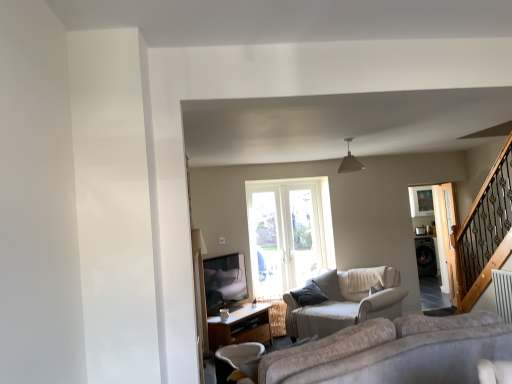
Question: From the image's perspective, relative to clear glass screen door at right, the second screen door positioned from the back, is beige fabric studio couch at center above or below?

Choices:
 (A) below
 (B) above

Answer: (A)

Question: From their relative heights in the image, would you say beige fabric studio couch at center is taller or shorter than clear glass screen door at right, the second screen door positioned from the back?

Choices:
 (A) short
 (B) tall

Answer: (A)

Question: Which object is positioned farthest from the wooden table at lower center?

Choices:
 (A) beige fabric studio couch at center
 (B) clear glass screen door at right, the second screen door positioned from the back
 (C) clear glass screen door at right, the 1th screen door when ordered from back to front
 (D) white fabric chair at lower center
 (E) black glossy washing machine at right

Answer: (B)

Question: Which of these objects is positioned farthest from the clear glass screen door at right, acting as the 2th screen door starting from the front?

Choices:
 (A) clear glass screen door at right, the second screen door positioned from the back
 (B) wooden table at lower center
 (C) white fabric chair at lower center
 (D) black glossy washing machine at right
 (E) beige fabric studio couch at center

Answer: (C)